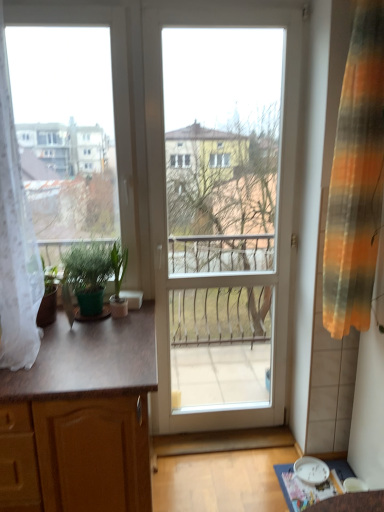
Find the location of `free space above transparent glass window screen at left (from a real-world perspective)`. free space above transparent glass window screen at left (from a real-world perspective) is located at coordinates (66, 0).